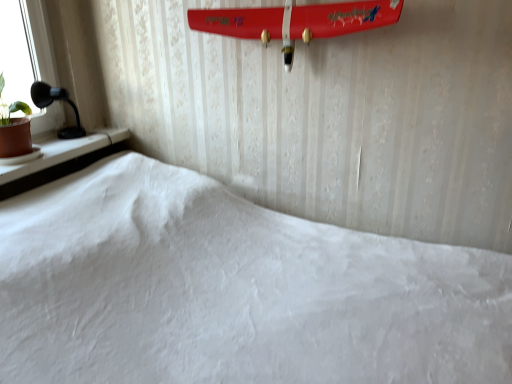
Question: Relative to black plastic table lamp at left, is brown clay pot at left in front or behind?

Choices:
 (A) front
 (B) behind

Answer: (A)

Question: From the image's perspective, is brown clay pot at left located above or below black plastic table lamp at left?

Choices:
 (A) above
 (B) below

Answer: (B)

Question: Estimate the real-world distances between objects in this image. Which object is farther from the brown clay pot at left?

Choices:
 (A) shiny red surfboard at upper center
 (B) black plastic table lamp at left

Answer: (A)

Question: Which of these objects is positioned farthest from the shiny red surfboard at upper center?

Choices:
 (A) black plastic table lamp at left
 (B) brown clay pot at left

Answer: (B)